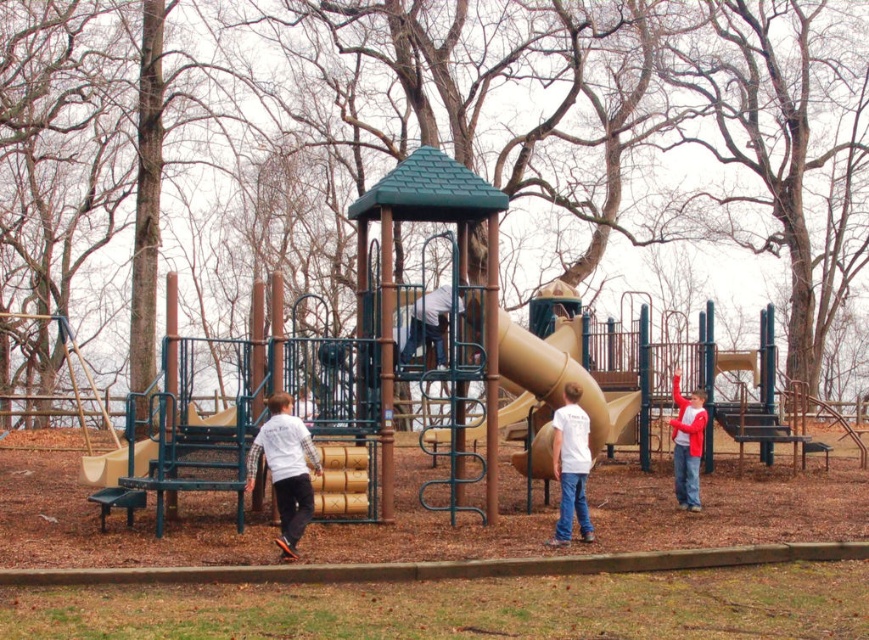
Does beige rubber slide at center lie behind white matte shirt at center?

Yes, beige rubber slide at center is further from the viewer.

The height and width of the screenshot is (640, 869). What do you see at coordinates (554, 388) in the screenshot? I see `beige rubber slide at center` at bounding box center [554, 388].

Find the location of a particular element. This screenshot has height=640, width=869. beige rubber slide at center is located at coordinates (554, 388).

In the scene shown: Does white matte shirt at center appear on the left side of white t-shirt at center?

Indeed, white matte shirt at center is positioned on the left side of white t-shirt at center.

Does white matte shirt at center have a smaller size compared to white t-shirt at center?

No, white matte shirt at center is not smaller than white t-shirt at center.

What do you see at coordinates (284, 468) in the screenshot?
I see `white matte shirt at center` at bounding box center [284, 468].

What are the coordinates of `white matte shirt at center` in the screenshot? It's located at (284, 468).

Between point (579, 484) and point (111, 460), which one is positioned in front?

Point (579, 484)

Is white t-shirt at center to the right of smooth tan slide at lower left from the viewer's perspective?

Indeed, white t-shirt at center is positioned on the right side of smooth tan slide at lower left.

Describe the element at coordinates (571, 467) in the screenshot. I see `white t-shirt at center` at that location.

The width and height of the screenshot is (869, 640). I want to click on white t-shirt at center, so click(x=571, y=467).